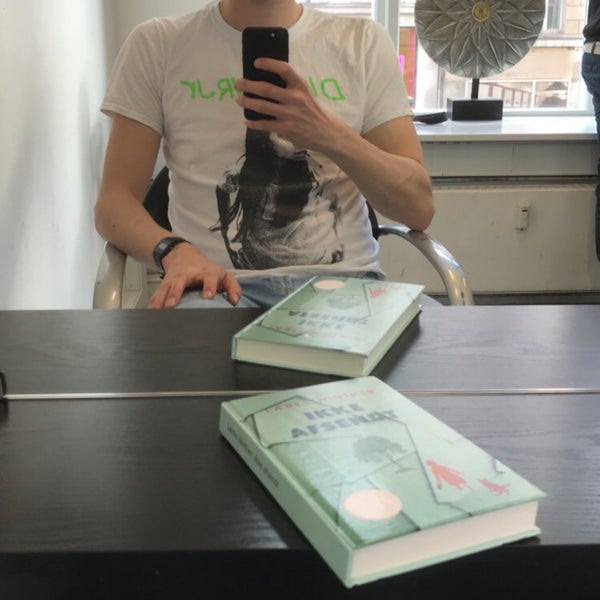
The image size is (600, 600). In order to click on phone in this screenshot , I will do `click(258, 40)`.